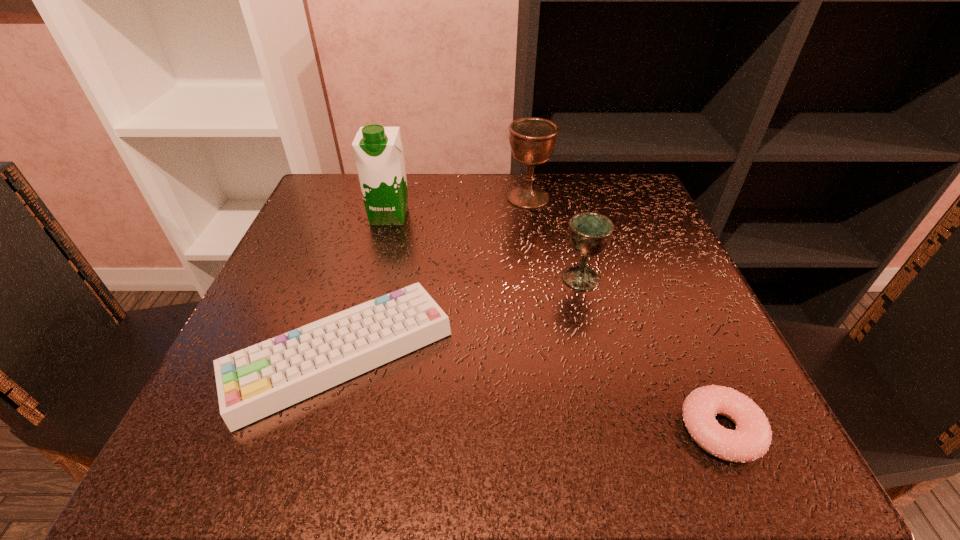
Where is `soya milk`? The width and height of the screenshot is (960, 540). soya milk is located at coordinates (378, 150).

You are a GUI agent. You are given a task and a screenshot of the screen. Output one action in this format:
    pyautogui.click(x=<x>, y=<y>)
    Task: Click on the farther chalice
    The width and height of the screenshot is (960, 540).
    Given the screenshot: What is the action you would take?
    pyautogui.click(x=532, y=140)

Find the location of a particular element. the second tallest object is located at coordinates (532, 140).

Identify the location of the third tallest object. Image resolution: width=960 pixels, height=540 pixels. [589, 233].

Locate an element on the screen. This screenshot has height=540, width=960. the nearer chalice is located at coordinates (589, 233).

Where is `computer keyboard`? The image size is (960, 540). computer keyboard is located at coordinates (255, 382).

Identify the location of the rightmost object. The height and width of the screenshot is (540, 960). (750, 441).

Identify the location of doughnut. (750, 441).

The height and width of the screenshot is (540, 960). In order to click on free location located 0.210m on the front-facing side of the soya milk in this screenshot , I will do `click(367, 298)`.

This screenshot has height=540, width=960. Find the location of `free location located on the back of the second tallest object`. free location located on the back of the second tallest object is located at coordinates (525, 176).